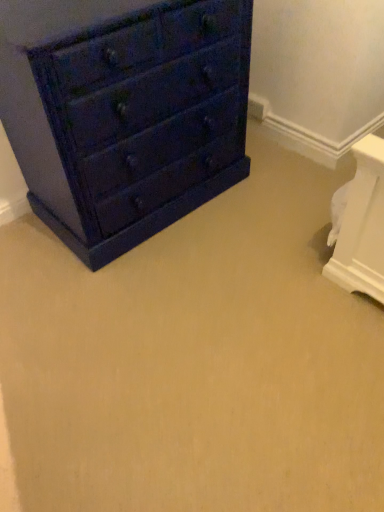
Describe the element at coordinates (125, 114) in the screenshot. Image resolution: width=384 pixels, height=512 pixels. I see `matte dark blue dresser at left` at that location.

The image size is (384, 512). Find the location of `matte dark blue dresser at left`. matte dark blue dresser at left is located at coordinates (125, 114).

Based on the photo, measure the distance between point (159, 225) and camera.

Point (159, 225) is 1.90 meters from camera.

At what (x,y) coordinates should I click in order to perform the action: click on matte dark blue dresser at left. Please return your answer as a coordinate pair (x, y). Looking at the image, I should click on [125, 114].